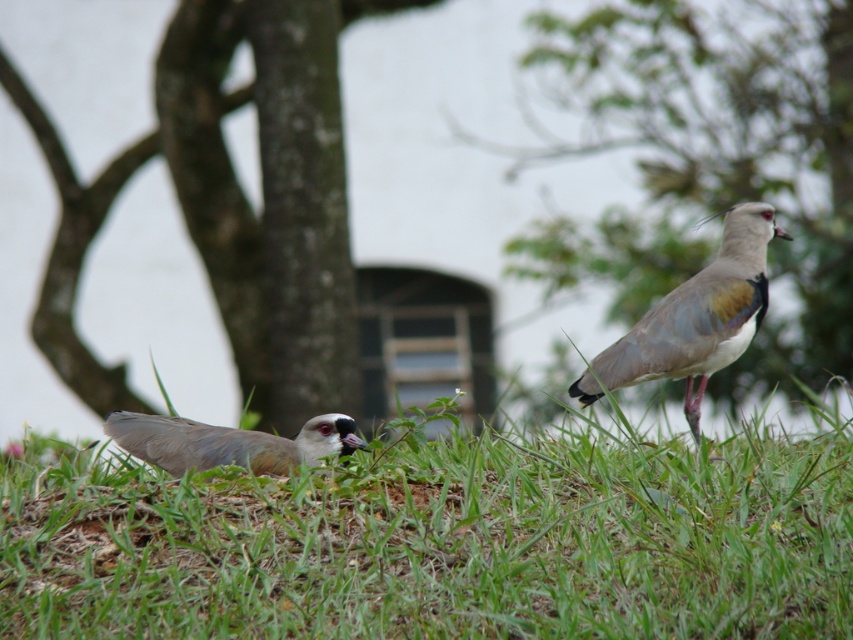
You are a photographer trying to capture both the green grass at lower left and the brown feathered bird at lower left in a single frame. Based on their sizes, which one would appear more dominant in the photo?

The green grass at lower left would appear more dominant in the photo because its width is larger than the brown feathered bird at lower left.

You are standing in the scene and want to pick up an object located at point (572,291) and another object at point (198,452). Which point is closer to you?

Point (572,291) is closer to you because it is further to the camera than point (198,452).